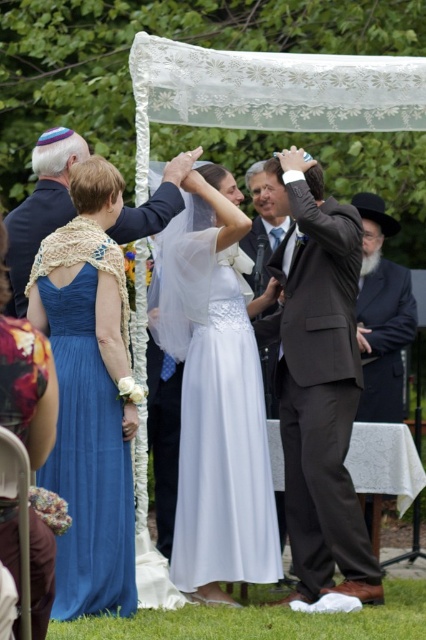
You are a photographer at a wedding and need to capture a photo of the blue satin dress at left and the white satin dress at center. Since the dresses are at different heights, which dress should you focus on first to ensure both are in frame?

The blue satin dress at left is taller than the white satin dress at center, so you should focus on the blue satin dress at left first to ensure both are in frame.